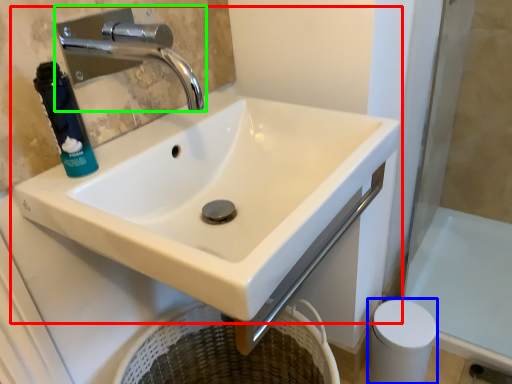
Question: Which is farther away from sink (highlighted by a red box)? toilet paper (highlighted by a blue box) or tap (highlighted by a green box)?

Choices:
 (A) toilet paper
 (B) tap

Answer: (B)